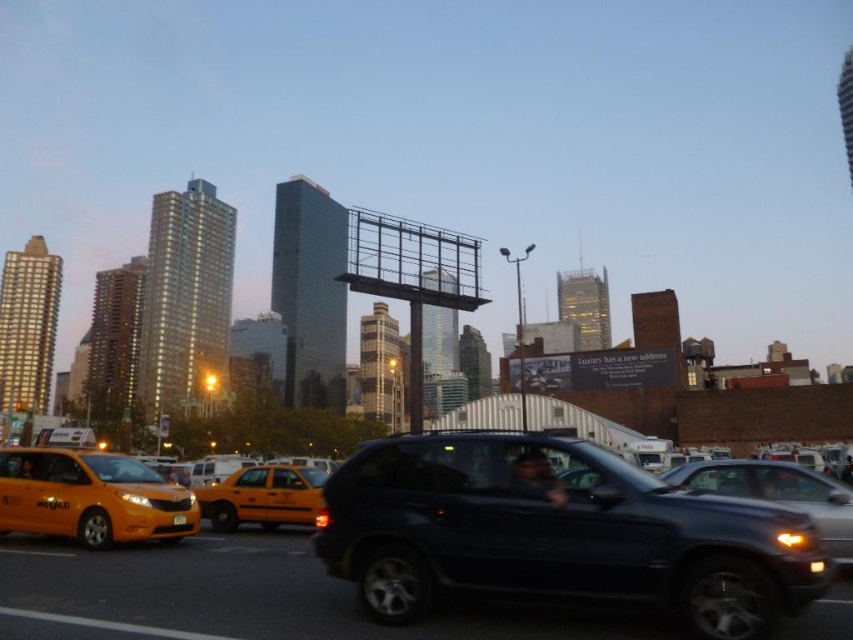
You are a passenger in a car and see the point marked at coordinates (90,497) on a map. What object does this point correspond to?

The point marked at coordinates (90,497) corresponds to the yellow matte taxi at left.

You are a delivery driver navigating through the bustling urban scene described. You need to make a quick turn to avoid an obstacle. Which direction should you turn to avoid the yellow matte taxi at left?

The yellow matte taxi at left is located at point (90, 497), so you should turn to the right to avoid it.

You are a pedestrian trying to cross the street in front of the shiny black suv at center and the yellow matte taxi at left. Which vehicle should you wait for first before proceeding?

The shiny black suv at center is positioned over the yellow matte taxi at left, meaning it is closer to you. You should wait for the shiny black suv at center to pass first before proceeding.